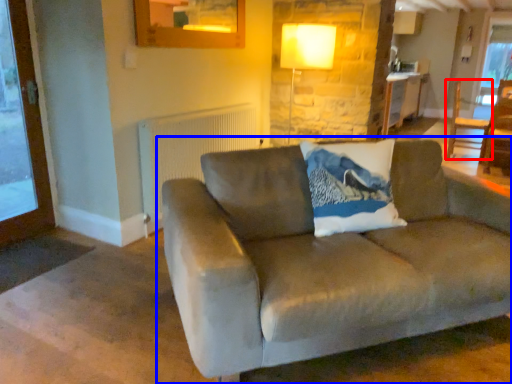
Question: Which object is closer to the camera taking this photo, chair (highlighted by a red box) or studio couch (highlighted by a blue box)?

Choices:
 (A) chair
 (B) studio couch

Answer: (B)